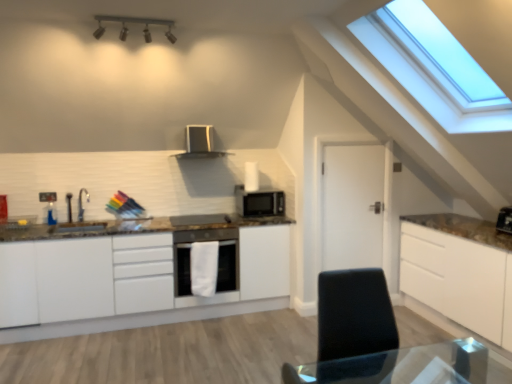
Question: Does white matte cabinet at center touch white matte door at center?

Choices:
 (A) yes
 (B) no

Answer: (B)

Question: Can you confirm if white matte cabinet at center is smaller than white matte door at center?

Choices:
 (A) yes
 (B) no

Answer: (B)

Question: Is the depth of white matte cabinet at center less than that of white matte door at center?

Choices:
 (A) yes
 (B) no

Answer: (A)

Question: From the image's perspective, is white matte cabinet at center over white matte door at center?

Choices:
 (A) yes
 (B) no

Answer: (B)

Question: Considering the relative positions of white matte cabinet at center and white matte door at center in the image provided, is white matte cabinet at center to the left of white matte door at center from the viewer's perspective?

Choices:
 (A) no
 (B) yes

Answer: (B)

Question: From the image's perspective, relative to satin silver microwave at center, is white glossy oven at center above or below?

Choices:
 (A) above
 (B) below

Answer: (B)

Question: In the image, is white glossy oven at center positioned in front of or behind satin silver microwave at center?

Choices:
 (A) front
 (B) behind

Answer: (A)

Question: Is white glossy oven at center inside the boundaries of satin silver microwave at center, or outside?

Choices:
 (A) outside
 (B) inside

Answer: (A)

Question: From a real-world perspective, relative to satin silver microwave at center, is white glossy oven at center vertically above or below?

Choices:
 (A) below
 (B) above

Answer: (A)

Question: Considering the positions of satin silver microwave at center and white matte cabinet at center in the image, is satin silver microwave at center wider or thinner than white matte cabinet at center?

Choices:
 (A) thin
 (B) wide

Answer: (A)

Question: Is satin silver microwave at center inside or outside of white matte cabinet at center?

Choices:
 (A) inside
 (B) outside

Answer: (A)

Question: From the image's perspective, is satin silver microwave at center located above or below white matte cabinet at center?

Choices:
 (A) above
 (B) below

Answer: (A)

Question: Is satin silver microwave at center bigger or smaller than white matte cabinet at center?

Choices:
 (A) small
 (B) big

Answer: (A)

Question: Based on their positions, is white matte door at center located to the left or right of metallic track lighting at upper center?

Choices:
 (A) right
 (B) left

Answer: (A)

Question: From a real-world perspective, is white matte door at center physically located above or below metallic track lighting at upper center?

Choices:
 (A) above
 (B) below

Answer: (B)